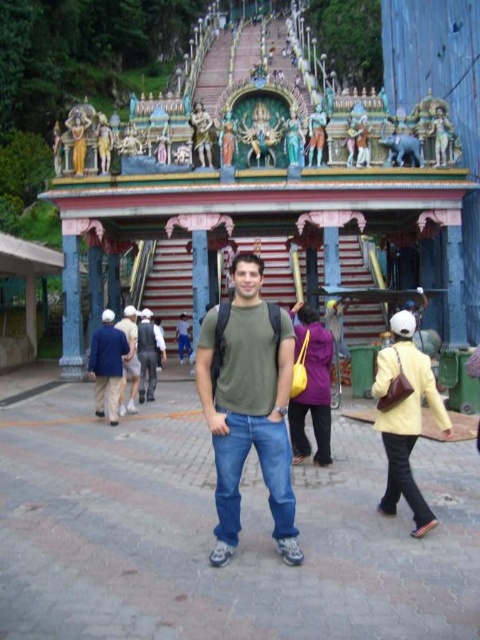
Question: Is yellow leather jacket at center to the right of dark gray jeans at center from the viewer's perspective?

Choices:
 (A) no
 (B) yes

Answer: (B)

Question: Where is yellow leather jacket at center located in relation to purple fabric bag at center in the image?

Choices:
 (A) right
 (B) left

Answer: (A)

Question: Which of the following is the closest to the observer?

Choices:
 (A) dark gray jeans at center
 (B) purple fabric bag at center
 (C) dark blue jeans at center
 (D) yellow leather jacket at center

Answer: (D)

Question: Which point is closer to the camera taking this photo?

Choices:
 (A) (299, 448)
 (B) (148, 372)
 (C) (406, 326)
 (D) (124, 340)

Answer: (C)

Question: Which point is farther to the camera?

Choices:
 (A) green matte t-shirt at center
 (B) light brown leather backpack at center
 (C) yellow leather jacket at center

Answer: (B)

Question: Can you confirm if purple fabric bag at center is positioned below light brown leather backpack at center?

Choices:
 (A) yes
 (B) no

Answer: (A)